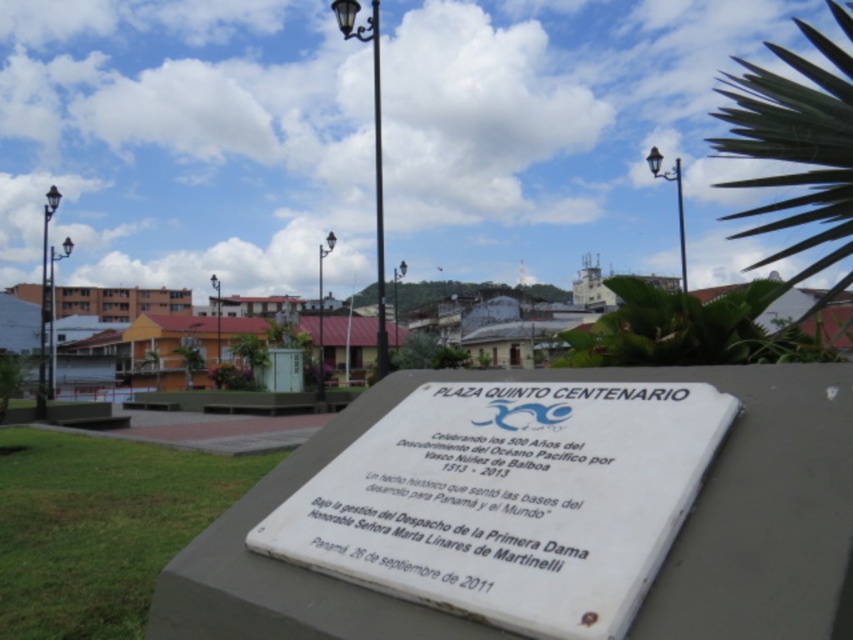
From the picture: You are a tourist in the park and want to take a photo of the white stone plaque at center. You notice a black metal lamp post at upper center might block your view. Based on their positions, will the lamp post block the plaque in your photo?

The white stone plaque at center is below the black metal lamp post at upper center, so the lamp post will block the plaque in your photo.

What are the coordinates of the white marble plaque at center in the image?

The white marble plaque at center is located at coordinates point (509, 499).

You are a tour guide explaining the historical significance of the white marble plaque at center and the metallic lamp post at upper center. Which object is located to the right of the other?

The white marble plaque at center is positioned on the right side of metallic lamp post at upper center.